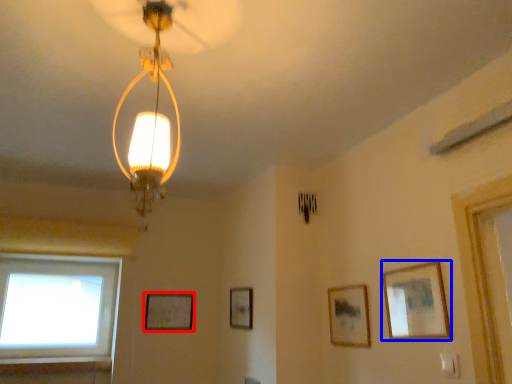
Question: Which of the following is the farthest to the observer, picture frame (highlighted by a red box) or picture frame (highlighted by a blue box)?

Choices:
 (A) picture frame
 (B) picture frame

Answer: (A)